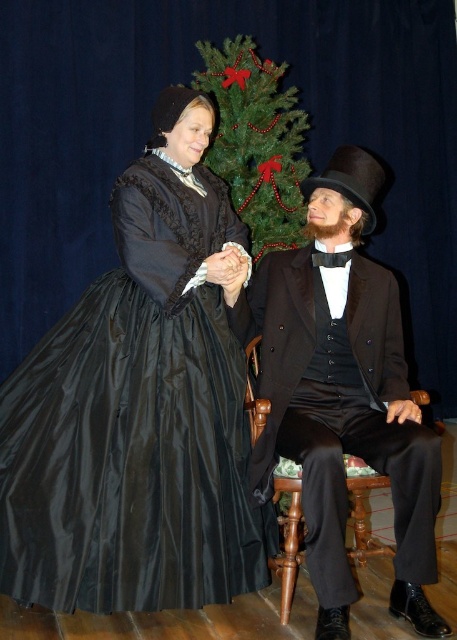
You are standing in front of a painting that shows two people from the 19th century. The person on the left is wearing a long dark Victorian dress with a black bonnet, and the person on the right is seated in a wooden chair wearing a dark suit, white shirt, black bow tie, and top hat. There is a specific point marked at coordinates [139,406] in the painting. What object from the scene is located exactly at this coordinate?

The matte black dress at center is located exactly at point [139,406].

You are an event planner arranging a historical reenactment. You need to position the matte black dress at center and the matte black suit at center so that they are visible to the audience. Based on their current positions, which one is more likely to block the other from the audience view?

The matte black dress at center is located above the matte black suit at center, so the dress is positioned higher and would block the suit from the audience view.